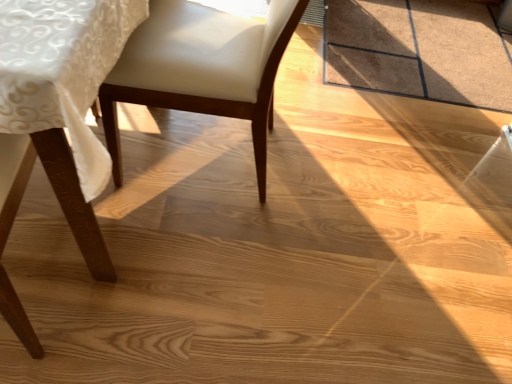
In order to click on free point below white leather chair at center, the 1th chair from the right (from a real-world perspective) in this screenshot , I will do (217, 160).